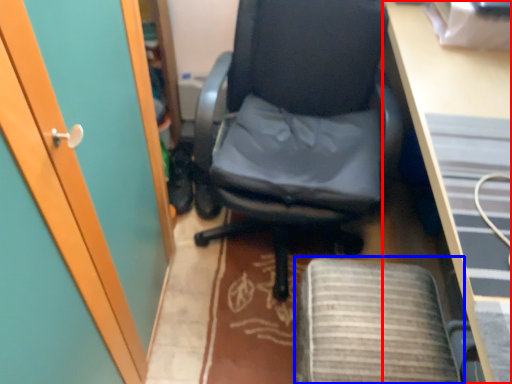
Question: Which point is closer to the camera, desk (highlighted by a red box) or computer chair (highlighted by a blue box)?

Choices:
 (A) desk
 (B) computer chair

Answer: (A)